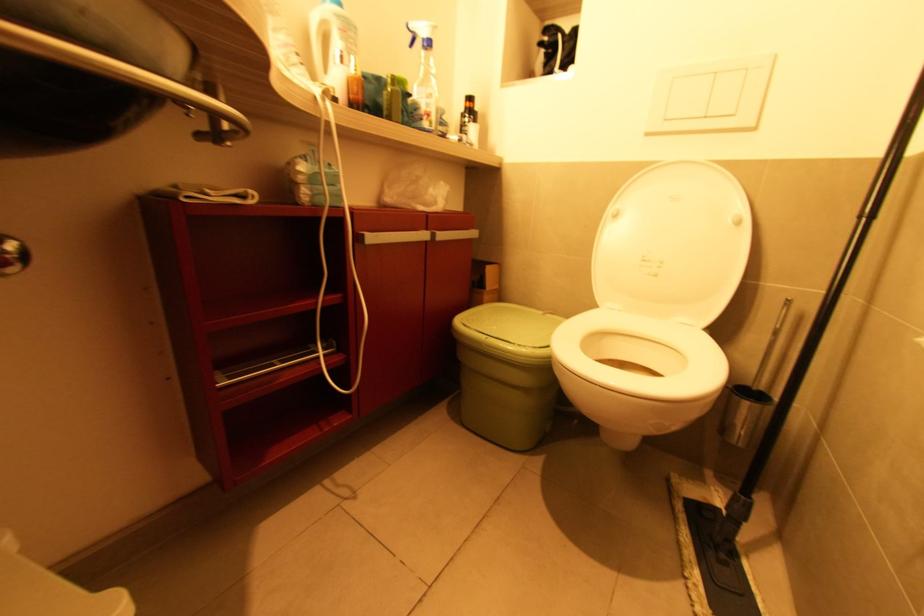
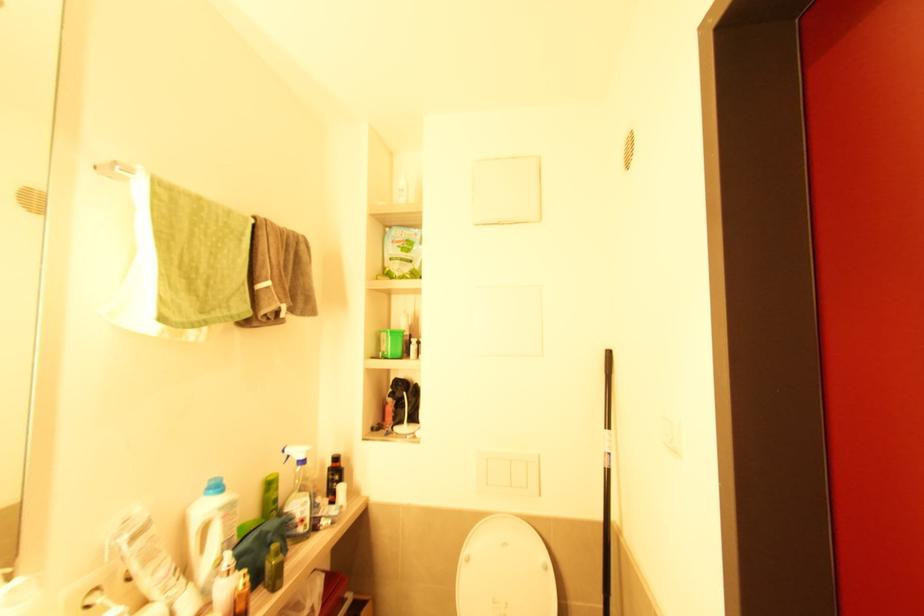
Find the pixel in the second image that matches point 432,46 in the first image.

(305, 462)